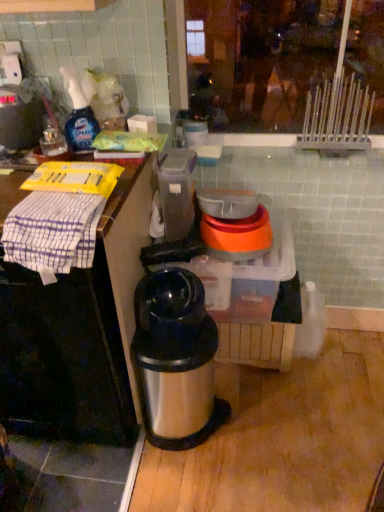
The width and height of the screenshot is (384, 512). Identify the location of empty space that is ontop of orange plastic bowl at center, which is the 1th appliance from right to left (from a real-world perspective). (243, 222).